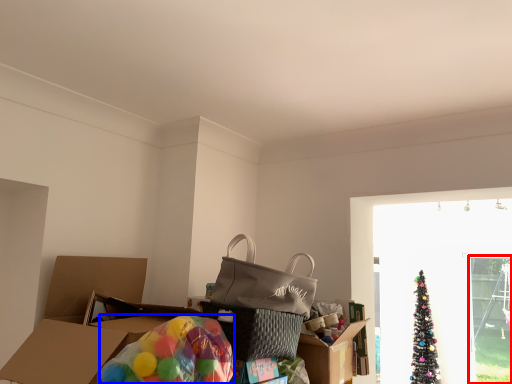
Question: Which point is further to the camera, screen door (highlighted by a red box) or balloon (highlighted by a blue box)?

Choices:
 (A) screen door
 (B) balloon

Answer: (A)